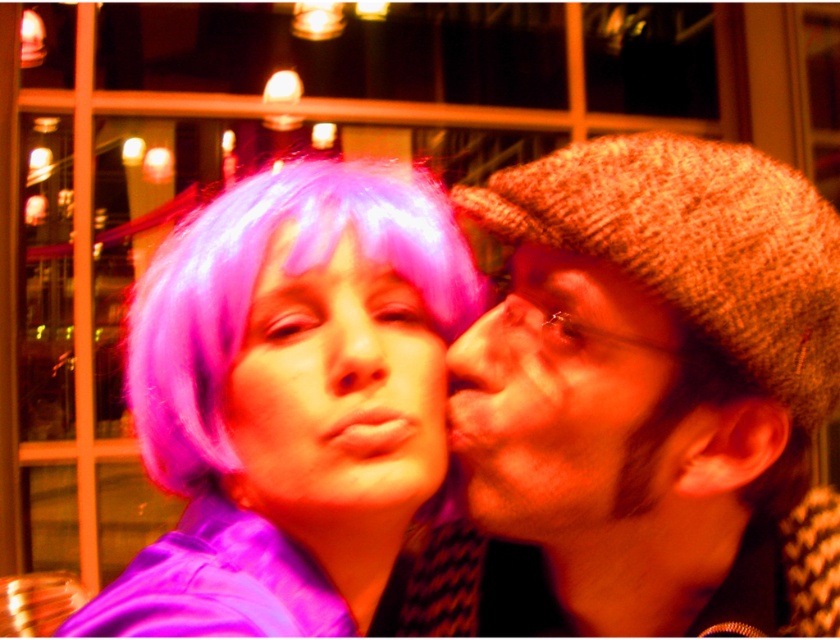
From the picture: You are taking a photo of two people in a dimly lit indoor setting. You want to focus on the person closer to the camera. Which of the two points, point (634, 380) or point (487, 376), should you focus on?

You should focus on point (634, 380) because it is closer to the camera than point (487, 376).

You are a photographer setting up for a portrait session and notice the purple wig at center and the matte brown nose at center in your frame. Based on their positions, which object is closer to the left side of the image?

The purple wig at center is positioned to the left of the matte brown nose at center, so it is closer to the left side of the image.

What object is located at the coordinates point [284,412] in the image?

The point [284,412] indicates the purple synthetic wig at upper left.